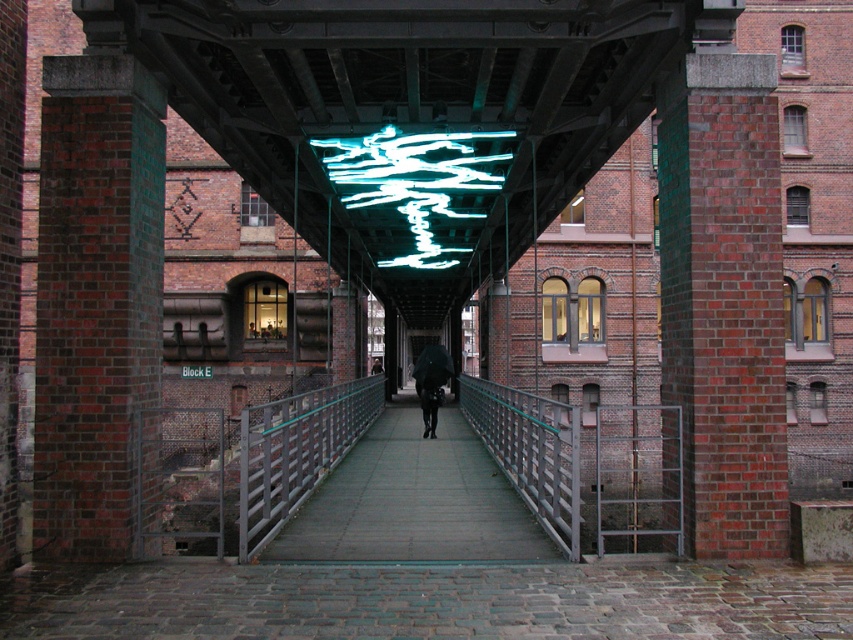
Question: Is smooth concrete walkway at center to the left of dark matte jacket at center from the viewer's perspective?

Choices:
 (A) yes
 (B) no

Answer: (B)

Question: Considering the real-world distances, which object is farthest from the translucent glass ceiling at center?

Choices:
 (A) metallic silver rail at center
 (B) smooth concrete walkway at center
 (C) dark matte jacket at center

Answer: (C)

Question: Which object is farther from the camera taking this photo?

Choices:
 (A) metallic gray rail at center
 (B) dark matte jacket at center
 (C) translucent glass ceiling at center
 (D) smooth concrete walkway at center

Answer: (B)

Question: Estimate the real-world distances between objects in this image. Which object is closer to the neon green glass at center?

Choices:
 (A) dark matte jacket at center
 (B) smooth concrete walkway at center
 (C) metallic gray rail at center

Answer: (C)

Question: From the image, what is the correct spatial relationship of neon green glass at center in relation to metallic gray rail at center?

Choices:
 (A) below
 (B) above

Answer: (B)

Question: Is smooth concrete walkway at center thinner than metallic gray rail at center?

Choices:
 (A) no
 (B) yes

Answer: (A)